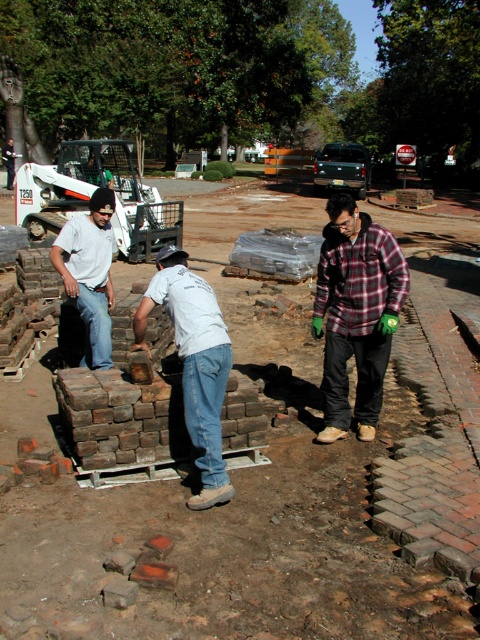
You are a construction worker standing at the point marked by coordinates point (239, 520). Looking around, you see the brown brick wall at center. Which direction should you move to reach the road in the background?

The road is in the background, so you should move towards the direction opposite of the brown brick wall at center to reach the road.

You are a construction worker who needs to hand a tool to both the light gray jeans at center and the white cotton shirt at left. Based on their positions, which worker should you approach first to ensure you can reach them without moving too far from your current spot?

You should approach the white cotton shirt at left first because the light gray jeans at center is to the right of white cotton shirt at left, meaning the white cotton shirt at left is closer to your current position.

You are a construction inspector checking the dimensions of the site. The brown brick wall at center and the white cotton shirt at left are both in your line of sight. Which object has a greater width according to the scene description?

The brown brick wall at center has a greater width than the white cotton shirt at left as stated in the description.